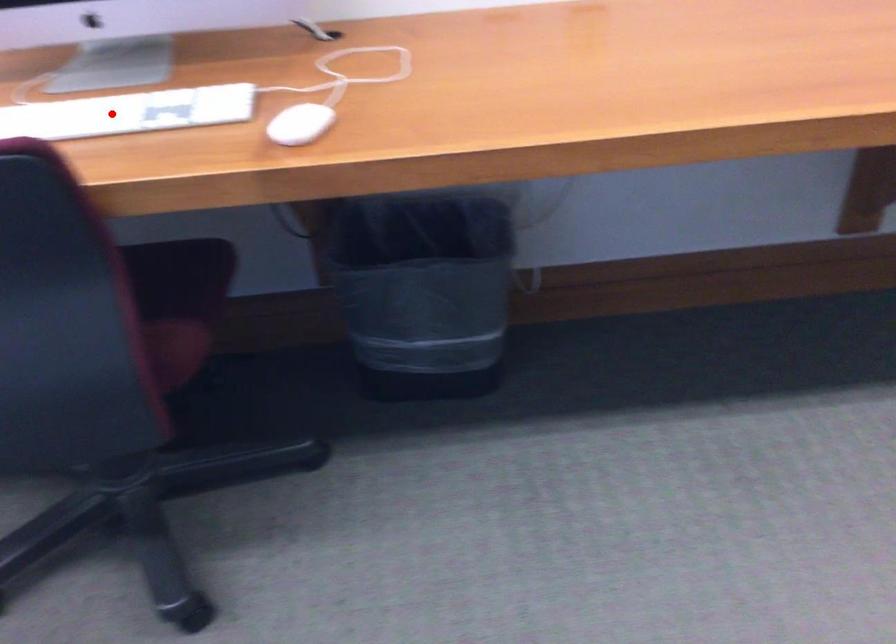
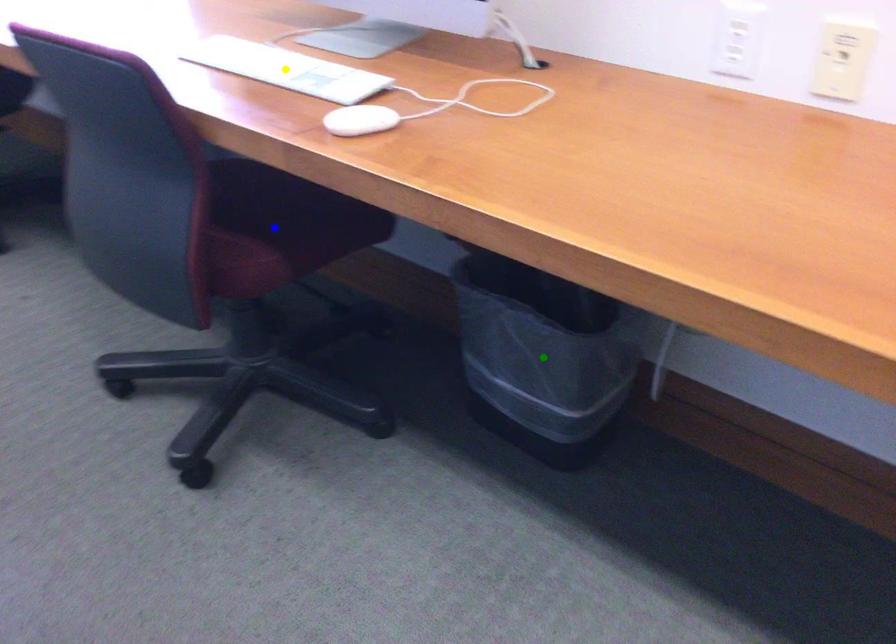
Question: I am providing you with two images of the same scene from different viewpoints. A red point is marked on the first image. You are given multiple points on the second image. Which mark in image 2 goes with the point in image 1?

Choices:
 (A) blue point
 (B) green point
 (C) yellow point

Answer: (C)